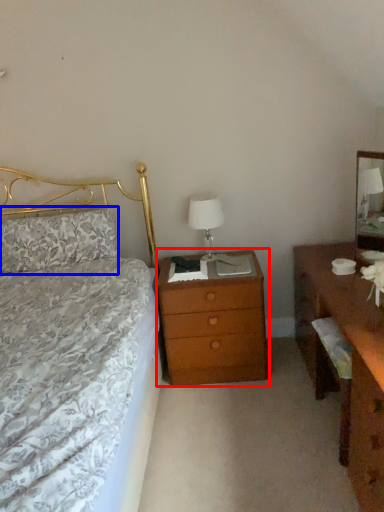
Question: Which object appears closest to the camera in this image, nightstand (highlighted by a red box) or pillow (highlighted by a blue box)?

Choices:
 (A) nightstand
 (B) pillow

Answer: (A)